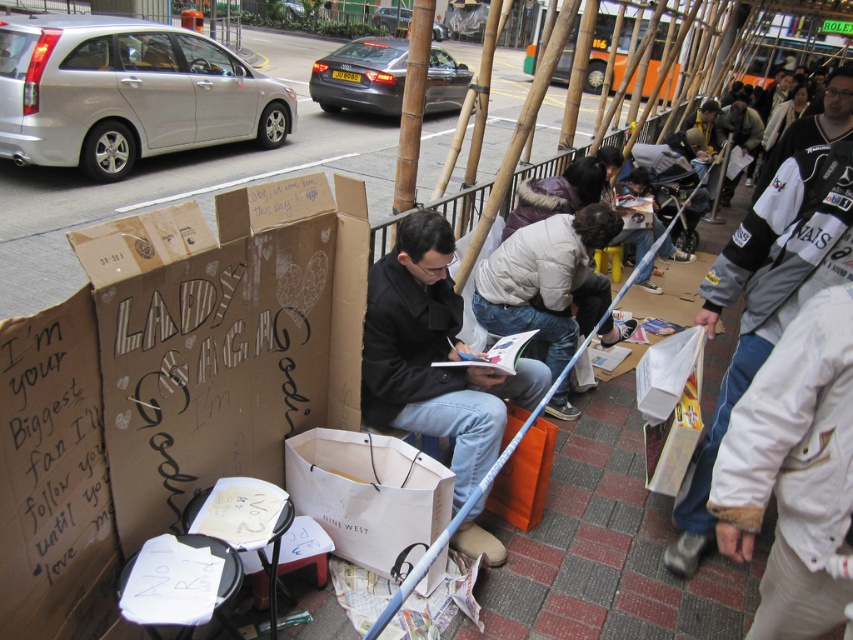
Looking at this image, you are a delivery person who needs to place a small package between the cardboard box at center and the gray fleece jacket at right. Which object should you place the package closer to if you want to ensure it doesn not get crushed?

The cardboard box at center is larger in size than the gray fleece jacket at right, so placing the package closer to the gray fleece jacket at right would leave more space and reduce the risk of it being crushed by the larger cardboard box at center.

From the picture: You are a delivery person who needs to place a package between the cardboard box at center and the gray fleece jacket at right. Is there enough space to fit the package between them?

The cardboard box at center is to the left of gray fleece jacket at right, so there is space between them to place the package.

You are a delivery robot with a width of 1.5 meters. You need to navigate between the cardboard box at center and the gray fleece jacket at right to deliver a package. Can you fit through the space between them?

The distance between the cardboard box at center and the gray fleece jacket at right is 1.80 meters. Since the robot is 1.5 meters wide, it can fit through the space as there is enough clearance.